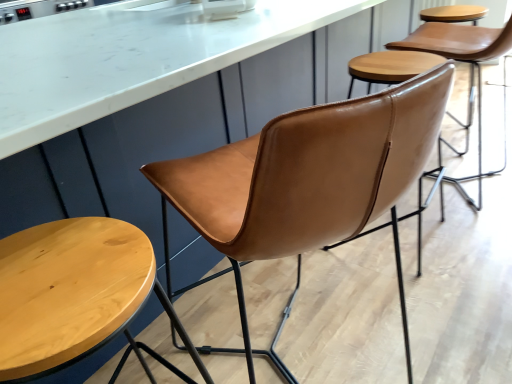
Locate an element on the screen. wooden stool at lower left is located at coordinates (76, 295).

Image resolution: width=512 pixels, height=384 pixels. Find the location of `cognac leather chair at center, acting as the 1th chair starting from the front`. cognac leather chair at center, acting as the 1th chair starting from the front is located at coordinates (307, 178).

Where is `wooden stool at lower left`? wooden stool at lower left is located at coordinates (76, 295).

Which is more to the left, cognac leather chair at center, which is the second chair in back-to-front order, or wooden stool at lower left?

wooden stool at lower left.

Is cognac leather chair at center, arranged as the first chair when viewed from the left, next to wooden stool at lower left?

cognac leather chair at center, arranged as the first chair when viewed from the left, is not next to wooden stool at lower left, and they're not touching.

Which is farther, (195, 183) or (84, 239)?

The point (195, 183) is more distant.

From the image's perspective, which is above, cognac leather chair at center, which is counted as the second chair, starting from the right, or wooden stool at lower left?

cognac leather chair at center, which is counted as the second chair, starting from the right, from the image's perspective.

How many degrees apart are the facing directions of cognac leather chair at center, which appears as the first chair when viewed from the back, and cognac leather chair at center, acting as the 1th chair starting from the front?

The angle between the facing direction of cognac leather chair at center, which appears as the first chair when viewed from the back, and the facing direction of cognac leather chair at center, acting as the 1th chair starting from the front, is 2.24 degrees.

Considering the positions of objects cognac leather chair at center, acting as the 1th chair starting from the right, and cognac leather chair at center, which is counted as the second chair, starting from the right, in the image provided, who is more to the right, cognac leather chair at center, acting as the 1th chair starting from the right, or cognac leather chair at center, which is counted as the second chair, starting from the right,?

Positioned to the right is cognac leather chair at center, acting as the 1th chair starting from the right.

Considering the relative sizes of cognac leather chair at center, the 2th chair positioned from the front, and cognac leather chair at center, which is counted as the second chair, starting from the right, in the image provided, is cognac leather chair at center, the 2th chair positioned from the front, taller than cognac leather chair at center, which is counted as the second chair, starting from the right,?

In fact, cognac leather chair at center, the 2th chair positioned from the front, may be shorter than cognac leather chair at center, which is counted as the second chair, starting from the right.

Locate an element on the screen. This screenshot has height=384, width=512. chair in front of the cognac leather chair at center, which appears as the first chair when viewed from the back is located at coordinates (307, 178).

Is cognac leather chair at center, which is counted as the second chair, starting from the right, in front of or behind cognac leather chair at center, the 2th chair positioned from the front, in the image?

Visually, cognac leather chair at center, which is counted as the second chair, starting from the right, is located in front of cognac leather chair at center, the 2th chair positioned from the front.

Is point (245, 204) more distant than point (510, 46)?

No.

Consider the image. Are cognac leather chair at center, acting as the 1th chair starting from the front, and cognac leather chair at center, acting as the 2th chair starting from the left, far apart?

Yes.

From a real-world perspective, is cognac leather chair at center, which appears as the first chair when viewed from the back, located beneath wooden stool at lower left?

Actually, cognac leather chair at center, which appears as the first chair when viewed from the back, is physically above wooden stool at lower left in the real world.

From the picture: Which is less distant, (476, 48) or (81, 253)?

The point (81, 253) is more forward.

Between cognac leather chair at center, acting as the 2th chair starting from the left, and wooden stool at lower left, which one has larger size?

cognac leather chair at center, acting as the 2th chair starting from the left.

Is wooden stool at lower left not close to cognac leather chair at center, which appears as the first chair when viewed from the back?

Yes, wooden stool at lower left and cognac leather chair at center, which appears as the first chair when viewed from the back, are quite far apart.

Would you say wooden stool at lower left is outside cognac leather chair at center, acting as the 2th chair starting from the left?

Yes, wooden stool at lower left is not within cognac leather chair at center, acting as the 2th chair starting from the left.

From a real-world perspective, is wooden stool at lower left positioned above or below cognac leather chair at center, acting as the 1th chair starting from the right?

wooden stool at lower left is situated lower than cognac leather chair at center, acting as the 1th chair starting from the right, in the real world.

Is wooden stool at lower left positioned in front of cognac leather chair at center, acting as the 2th chair starting from the left?

Yes, wooden stool at lower left is closer to the camera.

In the image, is wooden stool at lower left on the left side or the right side of cognac leather chair at center, which is the second chair in back-to-front order?

wooden stool at lower left is to the left of cognac leather chair at center, which is the second chair in back-to-front order.

From a real-world perspective, which object stands above the other?

cognac leather chair at center, which is the second chair in back-to-front order, is physically above.

How different are the orientations of wooden stool at lower left and cognac leather chair at center, which is counted as the second chair, starting from the right, in degrees?

The facing directions of wooden stool at lower left and cognac leather chair at center, which is counted as the second chair, starting from the right, are 4.41 degrees apart.

Which is behind, point (41, 351) or point (429, 113)?

The point (429, 113) is farther from the camera.

What are the coordinates of `the 1st chair to the right when counting from the wooden stool at lower left` in the screenshot? It's located at (307, 178).

Identify the location of chair below the cognac leather chair at center, the 2th chair positioned from the front (from the image's perspective). This screenshot has width=512, height=384. (307, 178).

Looking at the image, which one is located further to wooden stool at lower left, cognac leather chair at center, acting as the 1th chair starting from the right, or cognac leather chair at center, which is counted as the second chair, starting from the right?

Among the two, cognac leather chair at center, acting as the 1th chair starting from the right, is located further to wooden stool at lower left.

In the scene shown: Considering their positions, is cognac leather chair at center, which is counted as the second chair, starting from the right, positioned further to wooden stool at lower left than cognac leather chair at center, the 2th chair positioned from the front?

cognac leather chair at center, the 2th chair positioned from the front, is further to wooden stool at lower left.

Looking at the image, which one is located further to cognac leather chair at center, the 2th chair positioned from the front, cognac leather chair at center, which is the second chair in back-to-front order, or wooden stool at lower left?

wooden stool at lower left is further to cognac leather chair at center, the 2th chair positioned from the front.

Based on their spatial positions, is wooden stool at lower left or cognac leather chair at center, which is the second chair in back-to-front order, closer to cognac leather chair at center, which appears as the first chair when viewed from the back?

The object closer to cognac leather chair at center, which appears as the first chair when viewed from the back, is cognac leather chair at center, which is the second chair in back-to-front order.

Looking at the image, which one is located closer to cognac leather chair at center, arranged as the first chair when viewed from the left, cognac leather chair at center, which appears as the first chair when viewed from the back, or wooden stool at lower left?

Among the two, wooden stool at lower left is located nearer to cognac leather chair at center, arranged as the first chair when viewed from the left.

Based on their spatial positions, is wooden stool at lower left or cognac leather chair at center, acting as the 2th chair starting from the left, closer to cognac leather chair at center, which is the second chair in back-to-front order?

wooden stool at lower left is closer to cognac leather chair at center, which is the second chair in back-to-front order.

Locate an element on the screen. The height and width of the screenshot is (384, 512). chair between wooden stool at lower left and cognac leather chair at center, the 2th chair positioned from the front, in the horizontal direction is located at coordinates (307, 178).